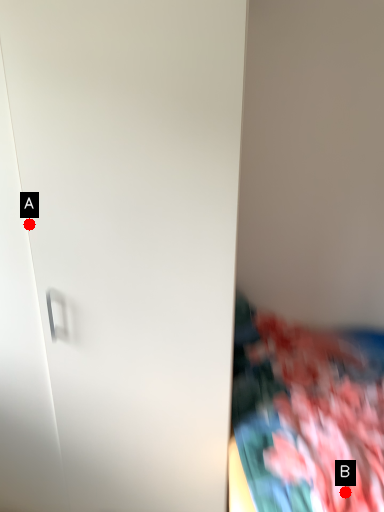
Question: Two points are circled on the image, labeled by A and B beside each circle. Which point is further to the camera?

Choices:
 (A) A is further
 (B) B is further

Answer: (B)